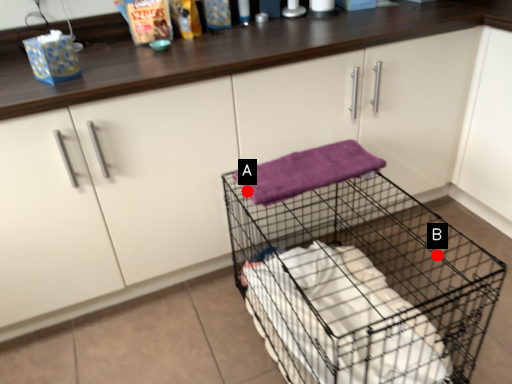
Question: Two points are circled on the image, labeled by A and B beside each circle. Among these points, which one is nearest to the camera?

Choices:
 (A) A is closer
 (B) B is closer

Answer: (A)